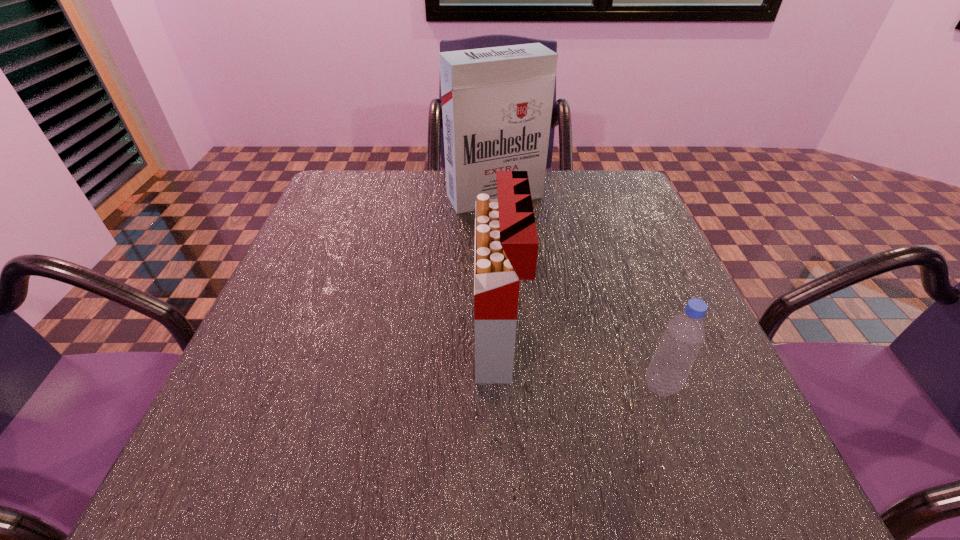
The height and width of the screenshot is (540, 960). What are the coordinates of `unoccupied area between the shortest object and the second shortest object` in the screenshot? It's located at point(580,363).

You are a GUI agent. You are given a task and a screenshot of the screen. Output one action in this format:
    pyautogui.click(x=<x>, y=<y>)
    Task: Click on the free space between the rightmost object and the taller cigarette case
    This screenshot has height=540, width=960.
    Given the screenshot: What is the action you would take?
    pyautogui.click(x=578, y=291)

What are the coordinates of `unoccupied area between the shortest object and the farther cigarette case` in the screenshot? It's located at (578, 291).

You are a GUI agent. You are given a task and a screenshot of the screen. Output one action in this format:
    pyautogui.click(x=<x>, y=<y>)
    Task: Click on the free space between the taller cigarette case and the shortest object
    The image size is (960, 540).
    Given the screenshot: What is the action you would take?
    pyautogui.click(x=578, y=291)

Locate an element on the screen. the second closest object to the shortest object is located at coordinates (497, 102).

This screenshot has width=960, height=540. In order to click on object that ranks as the closest to the shorter cigarette case in this screenshot , I will do `click(684, 335)`.

Locate an element on the screen. Image resolution: width=960 pixels, height=540 pixels. free space that satisfies the following two spatial constraints: 1. on the front side of the farther cigarette case; 2. with the lid open on the second shortest object is located at coordinates (501, 341).

You are a GUI agent. You are given a task and a screenshot of the screen. Output one action in this format:
    pyautogui.click(x=<x>, y=<y>)
    Task: Click on the vacant space that satisfies the following two spatial constraints: 1. with the lid open on the shortest object; 2. on the left side of the second tallest object
    
    Given the screenshot: What is the action you would take?
    pyautogui.click(x=499, y=386)

I want to click on free space that satisfies the following two spatial constraints: 1. with the lid open on the shorter cigarette case; 2. on the right side of the bottle, so click(x=499, y=386).

The height and width of the screenshot is (540, 960). Find the location of `free space that satisfies the following two spatial constraints: 1. with the lid open on the second shortest object; 2. on the left side of the shortest object`. free space that satisfies the following two spatial constraints: 1. with the lid open on the second shortest object; 2. on the left side of the shortest object is located at coordinates (499, 386).